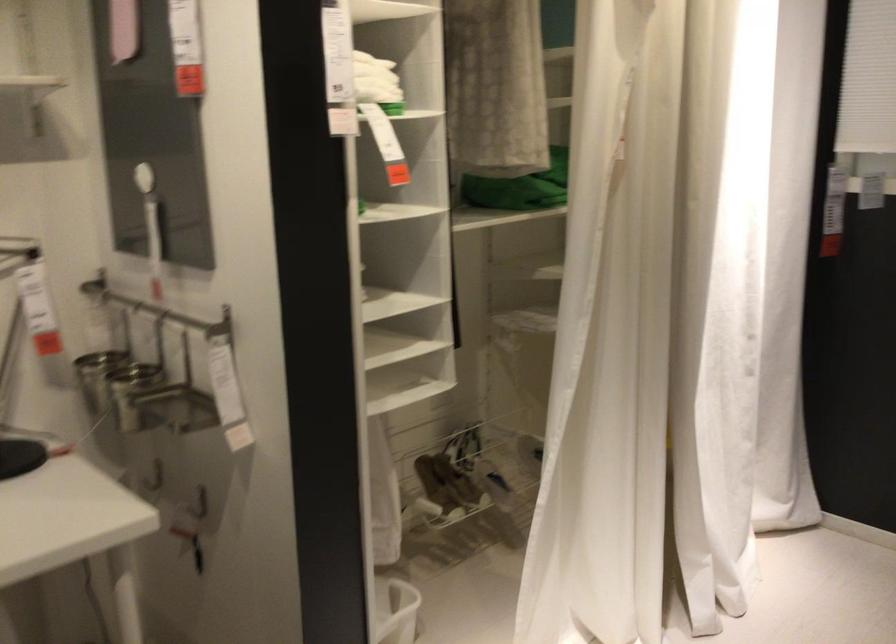
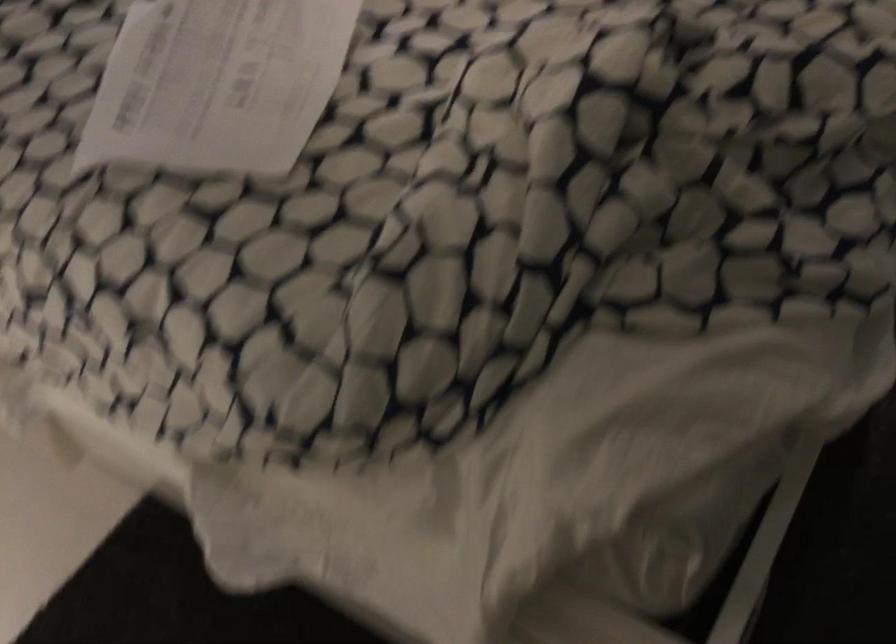
Based on the photo, how did the camera likely rotate?

The camera rotated toward right-down.